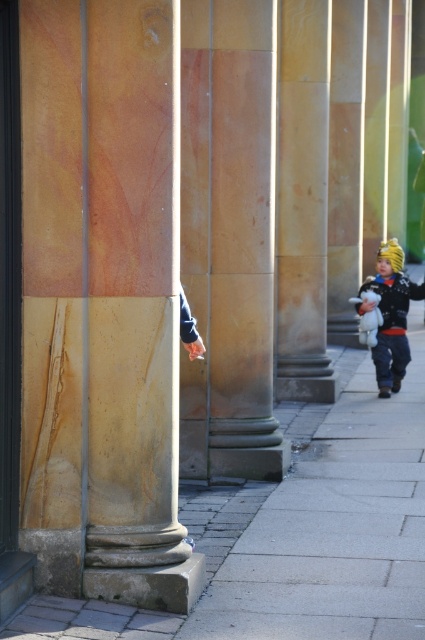
You are a landscape architect designing a garden pathway. You need to place a marble column at center and a gray concrete pavement at center. According to the scene, which object is narrower in width?

The marble column at center is thinner than the gray concrete pavement at center, so the marble column at center is narrower in width.

You are standing at the entrance of the walkway and want to reach the marble column at center. Which direction should you walk to get there?

The marble column at center is located at coordinates approximately 0.472 on the x axis and 0.240 on the y axis. Since you are at the entrance of the walkway, you should walk towards the center of the scene to reach it.